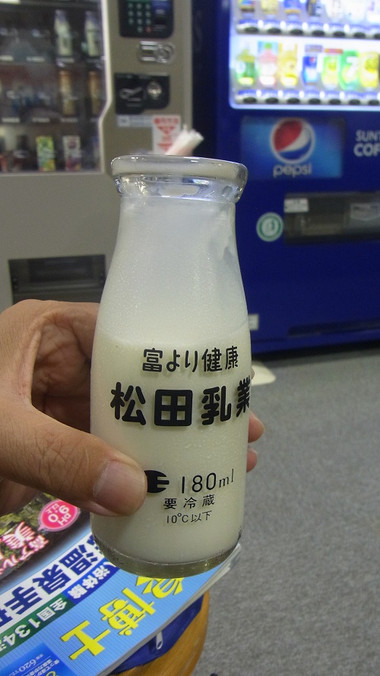
This screenshot has width=380, height=676. Identify the location of magazine. (84, 583).